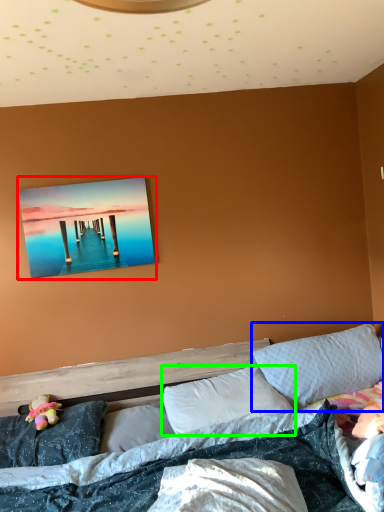
Question: Considering the real-world distances, which object is farthest from picture frame (highlighted by a red box)? pillow (highlighted by a blue box) or pillow (highlighted by a green box)?

Choices:
 (A) pillow
 (B) pillow

Answer: (A)